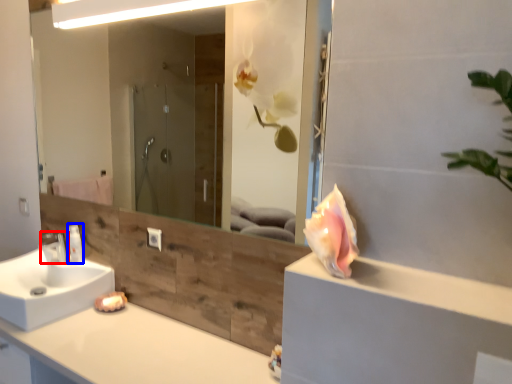
Question: Which object appears farthest to the camera in this image, tap (highlighted by a red box) or toiletry (highlighted by a blue box)?

Choices:
 (A) tap
 (B) toiletry

Answer: (B)